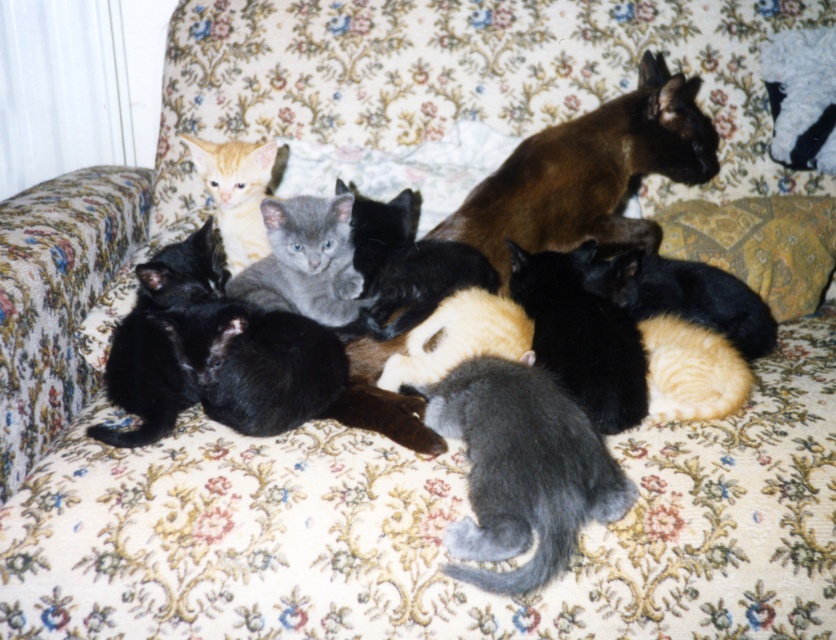
Does yellow paisley pillow at upper right come behind orange fur kitten at upper left?

Yes, it is.

Is yellow paisley pillow at upper right wider than orange fur kitten at upper left?

Yes, yellow paisley pillow at upper right is wider than orange fur kitten at upper left.

Identify the location of yellow paisley pillow at upper right. The width and height of the screenshot is (836, 640). (758, 244).

Who is more distant from viewer, (x=524, y=211) or (x=213, y=177)?

Positioned behind is point (x=213, y=177).

Can you confirm if brown silky cat at upper right is positioned to the left of orange fur kitten at upper left?

No, brown silky cat at upper right is not to the left of orange fur kitten at upper left.

Is point (543, 163) closer to viewer compared to point (247, 170)?

That is True.

Where is `brown silky cat at upper right`? The height and width of the screenshot is (640, 836). brown silky cat at upper right is located at coordinates (589, 173).

Is brown silky cat at upper right shorter than yellow paisley pillow at upper right?

Incorrect, brown silky cat at upper right's height does not fall short of yellow paisley pillow at upper right's.

The width and height of the screenshot is (836, 640). Describe the element at coordinates (589, 173) in the screenshot. I see `brown silky cat at upper right` at that location.

Image resolution: width=836 pixels, height=640 pixels. I want to click on brown silky cat at upper right, so click(589, 173).